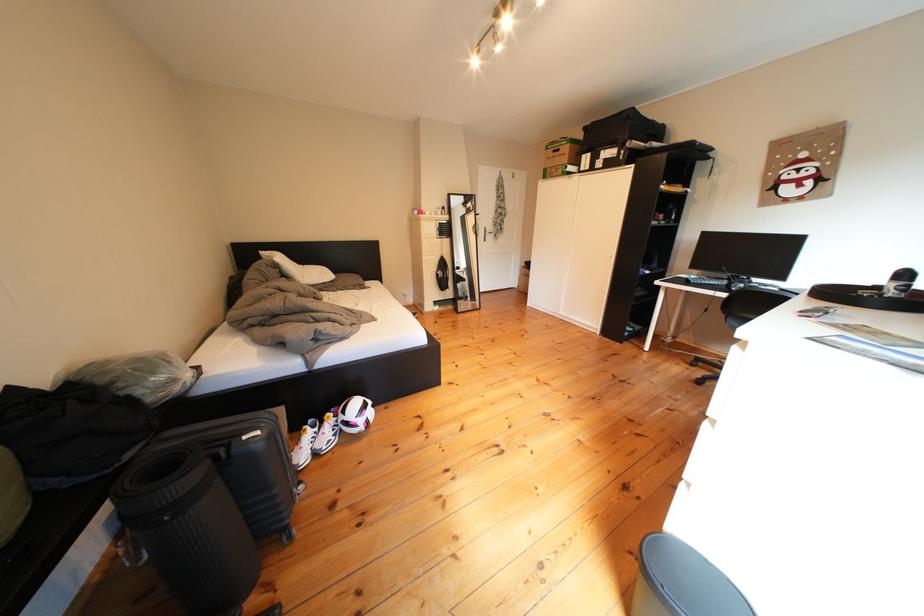
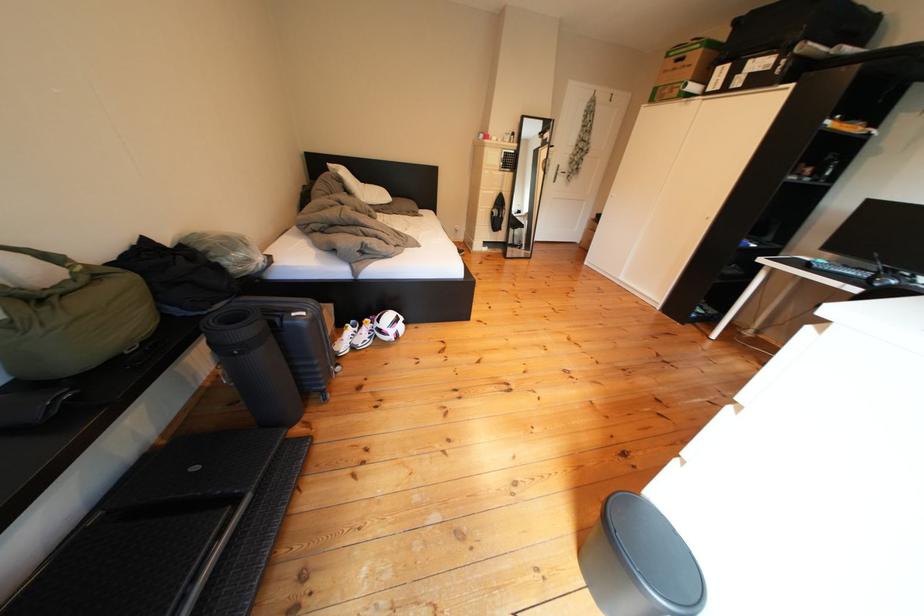
In the second image, find the point that corresponds to [331,434] in the first image.

(370, 334)